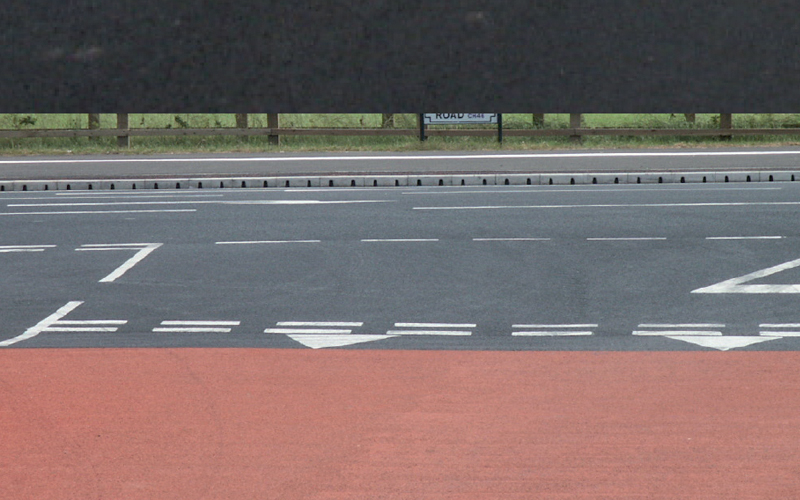
The height and width of the screenshot is (500, 800). I want to click on divider, so click(193, 189), click(478, 183), click(713, 177).